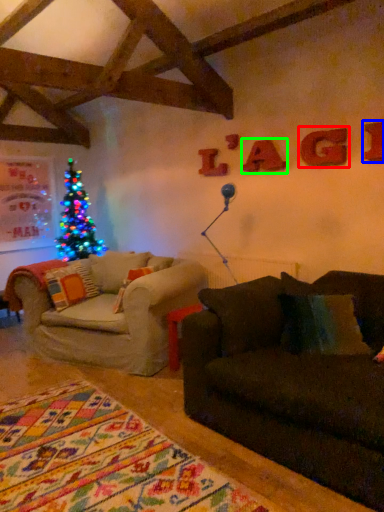
Question: Which object is positioned closest to letter (highlighted by a red box)? Select from letter (highlighted by a blue box) and letter (highlighted by a green box).

Choices:
 (A) letter
 (B) letter

Answer: (A)